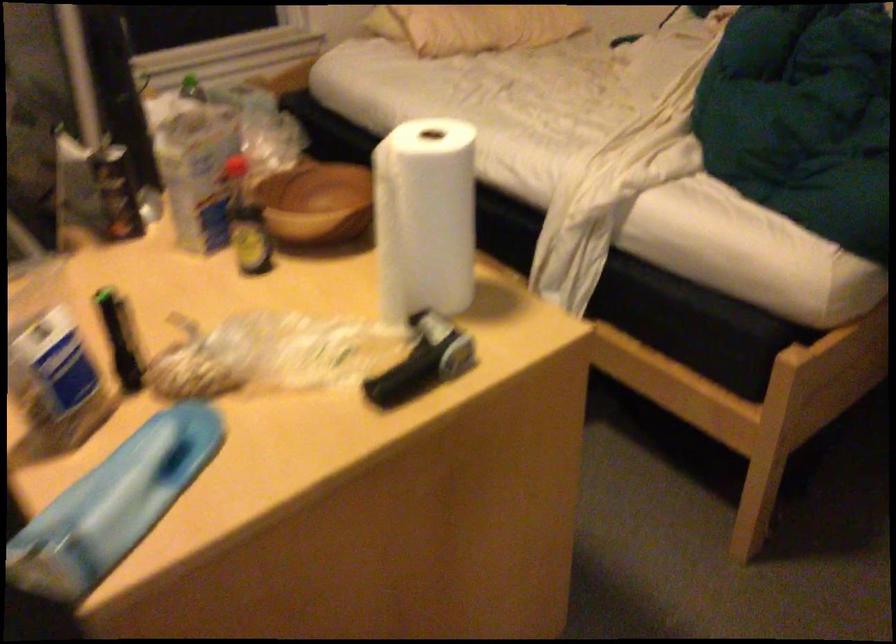
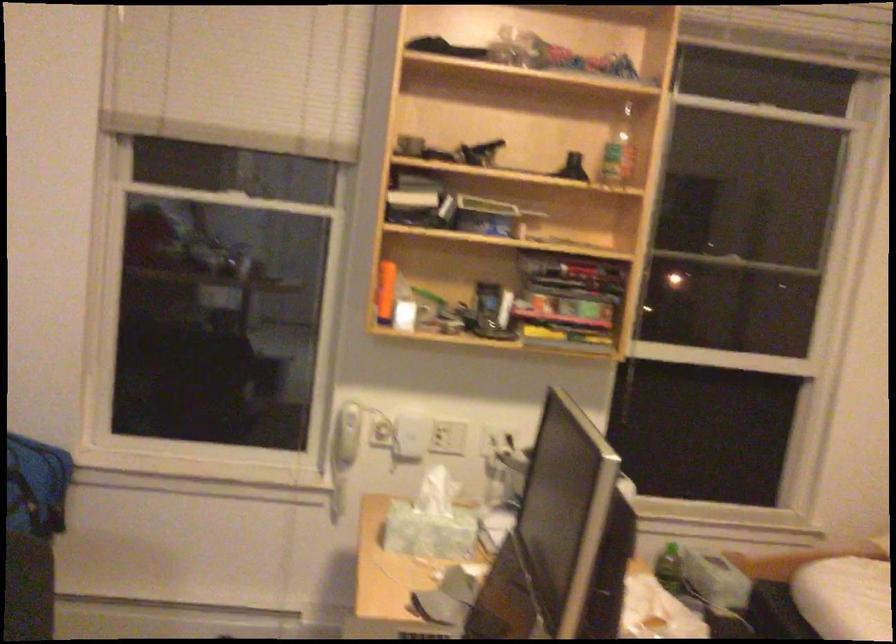
Find the pixel in the second image that matches [337,79] in the first image.

(845, 598)